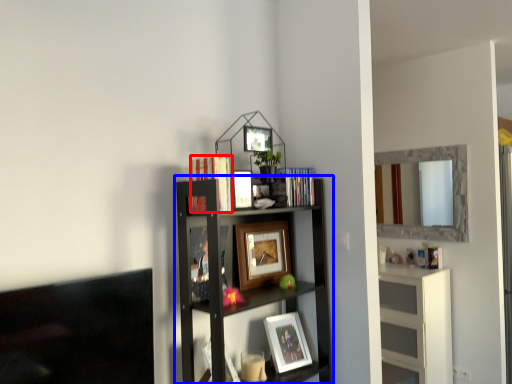
Question: Among these objects, which one is nearest to the camera, book (highlighted by a red box) or shelf (highlighted by a blue box)?

Choices:
 (A) book
 (B) shelf

Answer: (B)